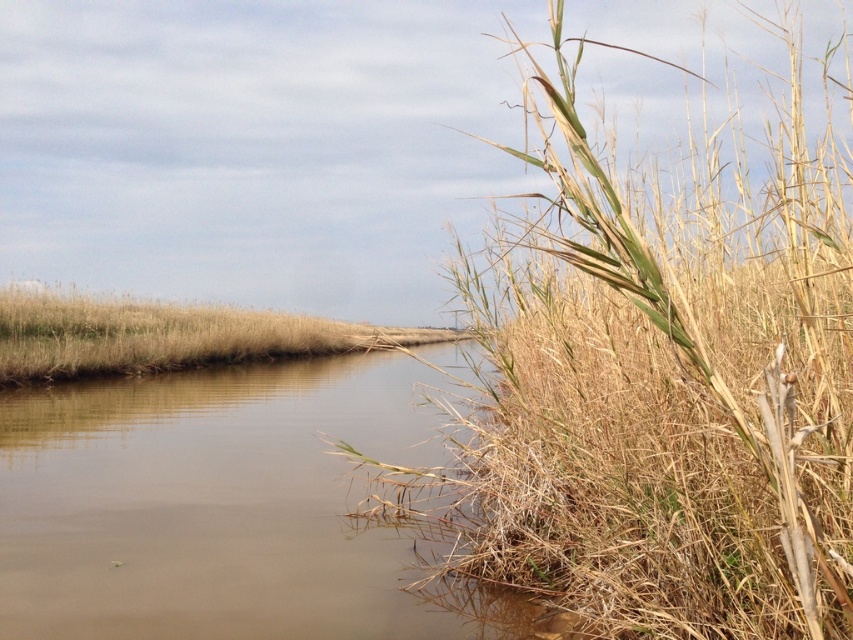
Is brown muddy water at center bigger than dry grass at center?

No, brown muddy water at center is not bigger than dry grass at center.

Between point (178, 570) and point (190, 333), which one is positioned in front?

Point (178, 570)

You are a GUI agent. You are given a task and a screenshot of the screen. Output one action in this format:
    pyautogui.click(x=<x>, y=<y>)
    Task: Click on the brown muddy water at center
    The height and width of the screenshot is (640, 853).
    Given the screenshot: What is the action you would take?
    pyautogui.click(x=228, y=509)